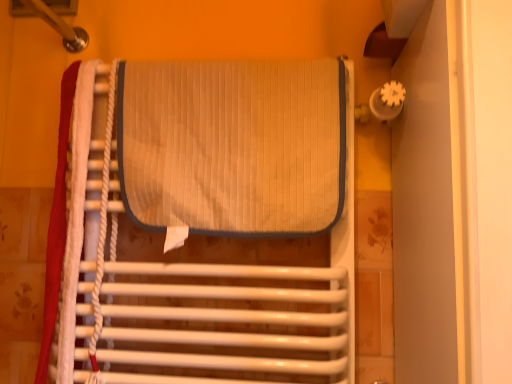
The height and width of the screenshot is (384, 512). I want to click on beige textured mat at center, so click(x=233, y=145).

What is the approximate width of white rope at left?

The width of white rope at left is 1.91 inches.

In order to click on white rope at left in this screenshot , I will do `click(102, 233)`.

The image size is (512, 384). What do you see at coordinates (211, 223) in the screenshot?
I see `textured beige mat at center` at bounding box center [211, 223].

You are a GUI agent. You are given a task and a screenshot of the screen. Output one action in this format:
    pyautogui.click(x=<x>, y=<y>)
    Task: Click on the beige textured mat at center
    The height and width of the screenshot is (384, 512).
    Given the screenshot: What is the action you would take?
    pyautogui.click(x=233, y=145)

From a real-world perspective, is textured beige mat at center positioned under white rope at left based on gravity?

Yes, from a real-world perspective, textured beige mat at center is under white rope at left.

From the image's perspective, is textured beige mat at center under white rope at left?

Correct, textured beige mat at center appears lower than white rope at left in the image.

Is point (158, 222) farther from viewer compared to point (95, 370)?

No, it is in front of (95, 370).

Considering the positions of objects textured beige mat at center and white rope at left in the image provided, who is more to the right, textured beige mat at center or white rope at left?

textured beige mat at center is more to the right.

Which of these two, beige textured mat at center or white rope at left, stands shorter?

Standing shorter between the two is beige textured mat at center.

Is beige textured mat at center far away from white rope at left?

That's not correct — beige textured mat at center is a little close to white rope at left.

Is beige textured mat at center situated inside white rope at left or outside?

beige textured mat at center is spatially situated outside white rope at left.

In the scene shown: Is beige textured mat at center oriented towards white rope at left?

No, beige textured mat at center is not aimed at white rope at left.

Looking at their sizes, would you say white rope at left is wider or thinner than beige textured mat at center?

In the image, white rope at left appears to be more narrow than beige textured mat at center.

The width and height of the screenshot is (512, 384). Find the location of `wide above the white rope at left (from the image's perspective)`. wide above the white rope at left (from the image's perspective) is located at coordinates click(233, 145).

Is white rope at left next to beige textured mat at center?

There is a gap between white rope at left and beige textured mat at center.

Consider the image. Is textured beige mat at center smaller than beige textured mat at center?

No, textured beige mat at center is not smaller than beige textured mat at center.

From a real-world perspective, is textured beige mat at center located beneath beige textured mat at center?

Correct, in the physical world, textured beige mat at center is lower than beige textured mat at center.

Is beige textured mat at center at the back of textured beige mat at center?

Yes, beige textured mat at center is at the back of textured beige mat at center.

From the image's perspective, is beige textured mat at center located above textured beige mat at center?

Yes, from the image's perspective, beige textured mat at center is over textured beige mat at center.

Who is bigger, beige textured mat at center or textured beige mat at center?

With larger size is textured beige mat at center.

Is beige textured mat at center at the left side of textured beige mat at center?

Indeed, beige textured mat at center is positioned on the left side of textured beige mat at center.

Does beige textured mat at center turn towards textured beige mat at center?

Yes.

Is textured beige mat at center at the back of white rope at left?

Yes, white rope at left is facing away from textured beige mat at center.

From a real-world perspective, is white rope at left below textured beige mat at center?

Actually, white rope at left is physically above textured beige mat at center in the real world.

Is white rope at left not inside textured beige mat at center?

That's incorrect, white rope at left is not completely outside textured beige mat at center.

Is white rope at left positioned far away from textured beige mat at center?

white rope at left is near textured beige mat at center, not far away.

The width and height of the screenshot is (512, 384). Find the location of `rope behind the textured beige mat at center`. rope behind the textured beige mat at center is located at coordinates (102, 233).

Where is `wide above the white rope at left (from the image's perspective)`? wide above the white rope at left (from the image's perspective) is located at coordinates (233, 145).

From the image, which object appears to be nearer to white rope at left, textured beige mat at center or beige textured mat at center?

textured beige mat at center.

Looking at the image, which one is located further to white rope at left, beige textured mat at center or textured beige mat at center?

→ Among the two, beige textured mat at center is located further to white rope at left.

From the image, which object appears to be farther from textured beige mat at center, white rope at left or beige textured mat at center?

white rope at left is further to textured beige mat at center.

When comparing their distances from beige textured mat at center, does white rope at left or textured beige mat at center seem closer?

textured beige mat at center.

From the image, which object appears to be farther from textured beige mat at center, beige textured mat at center or white rope at left?

white rope at left lies further to textured beige mat at center than the other object.

Looking at the image, which one is located further to beige textured mat at center, textured beige mat at center or white rope at left?

white rope at left is further to beige textured mat at center.

Locate an element on the screen. wide situated between white rope at left and textured beige mat at center from left to right is located at coordinates (233, 145).